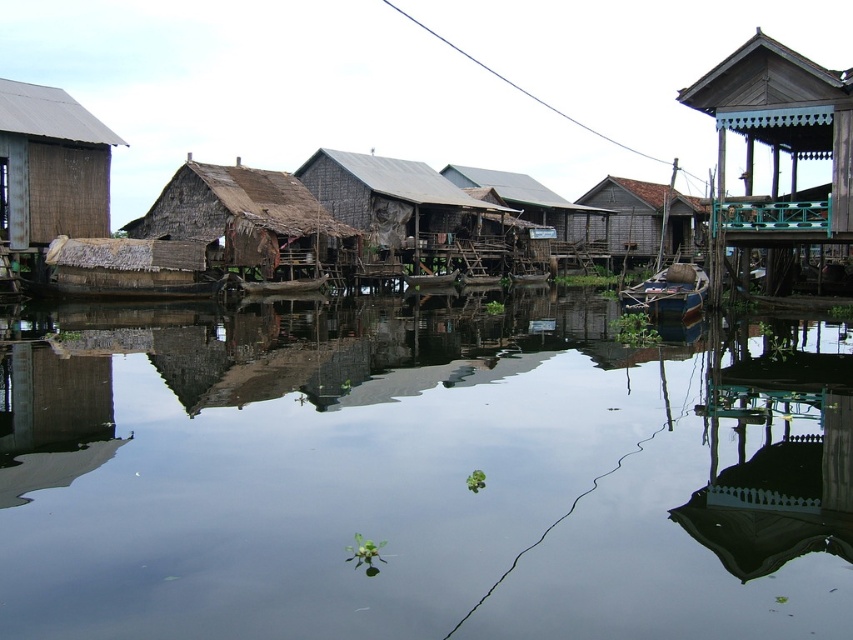
Looking at this image, you are standing in the water village and want to take a photo of both the point at coordinates (467, 156) and the point at (198, 240). Which point should you focus on first to ensure both are in focus?

You should focus on the point at coordinates (467, 156) first because it is closer to the camera than the point at (198, 240). This ensures both points will be in focus as the point at (467, 156) is nearer and the other is further away.